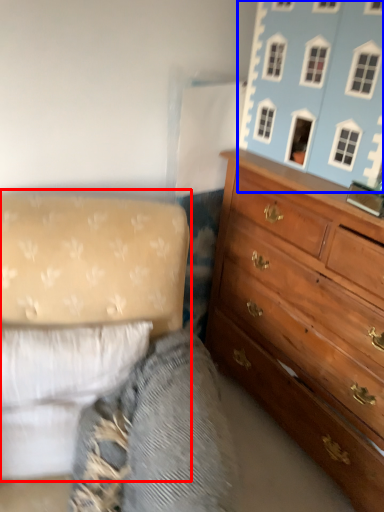
Question: Which object is further to the camera taking this photo, studio couch (highlighted by a red box) or toy (highlighted by a blue box)?

Choices:
 (A) studio couch
 (B) toy

Answer: (B)